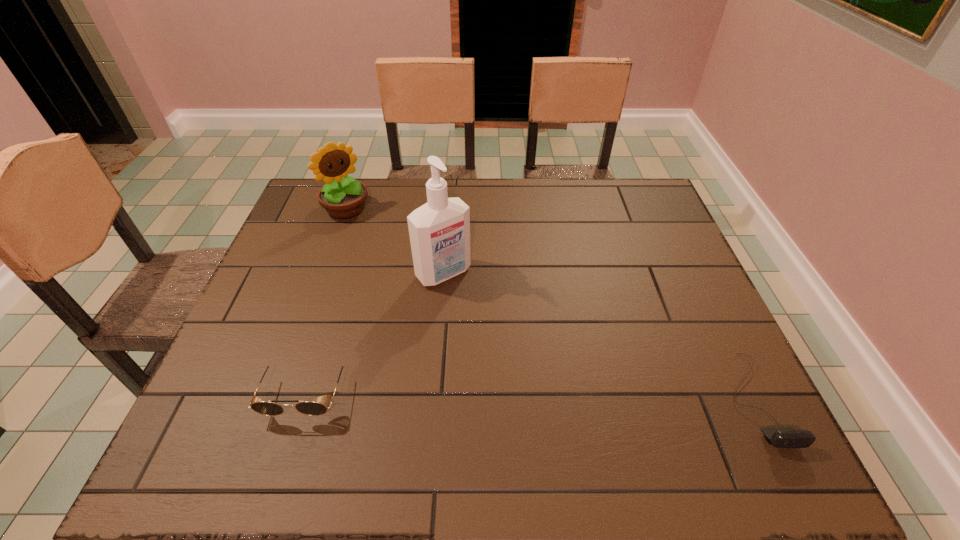
Find the location of a particular element. free space on the desktop that is between the sunglasses and the rightmost object and is positioned on the front label of the tallest object is located at coordinates (552, 395).

Locate an element on the screen. The width and height of the screenshot is (960, 540). vacant space on the desktop that is between the second shortest object and the webcam and is positioned on the face of the sunflower is located at coordinates (521, 395).